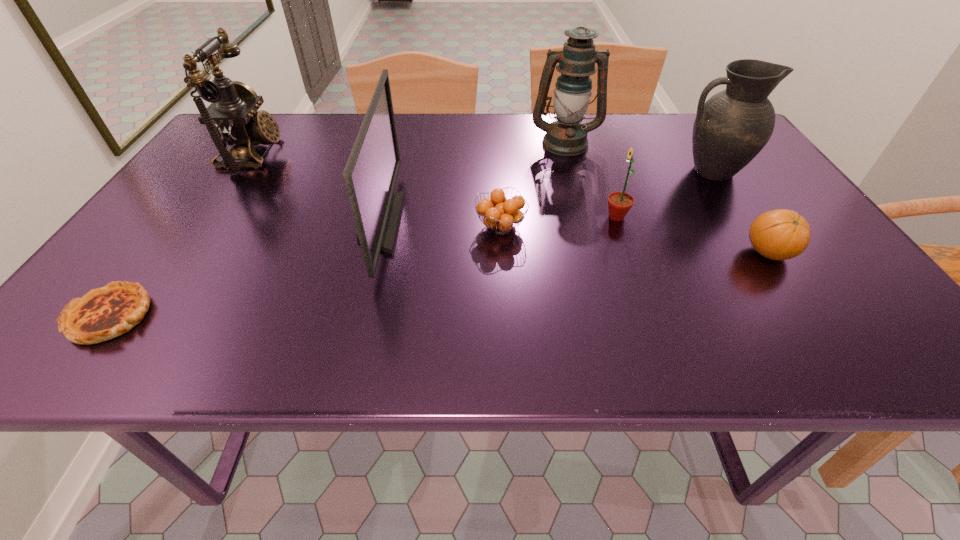
This screenshot has height=540, width=960. Identify the location of free space in the image that satisfies the following two spatial constraints: 1. on the screen side of the shorter orange fruit; 2. on the right side of the monitor. (380, 227).

Where is `free spot that satisfies the following two spatial constraints: 1. on the rotary dial of the left orange fruit; 2. on the left side of the telephone`? free spot that satisfies the following two spatial constraints: 1. on the rotary dial of the left orange fruit; 2. on the left side of the telephone is located at coordinates (204, 227).